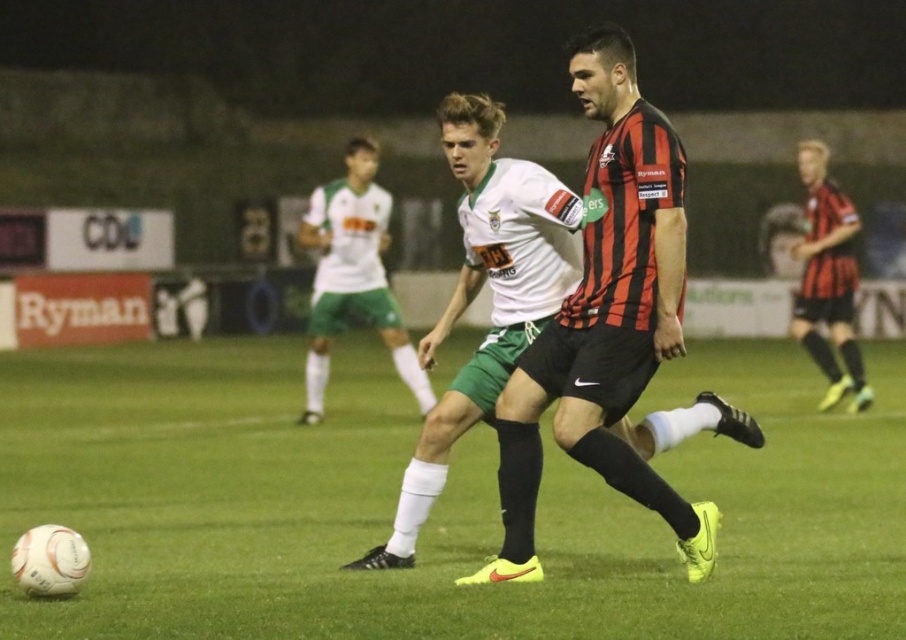
You are a soccer referee observing the game. You notice the white matte jersey at center and the matte black shorts at right. Which player is positioned higher up in the image?

The white matte jersey at center is positioned higher up in the image as it is much taller than the matte black shorts at right.

You are a soccer referee observing the match. You notice the white synthetic football at center and the matte black shorts at right. Which object is closer to the front of the image?

The white synthetic football at center is in front of matte black shorts at right, so it is closer to the front of the image.

You are a soccer referee standing at the edge of the field. You notice the white synthetic football at center and the white matte jersey at center. Which object is higher up in the image?

The white synthetic football at center has a greater height compared to the white matte jersey at center, so the football is higher up in the image.